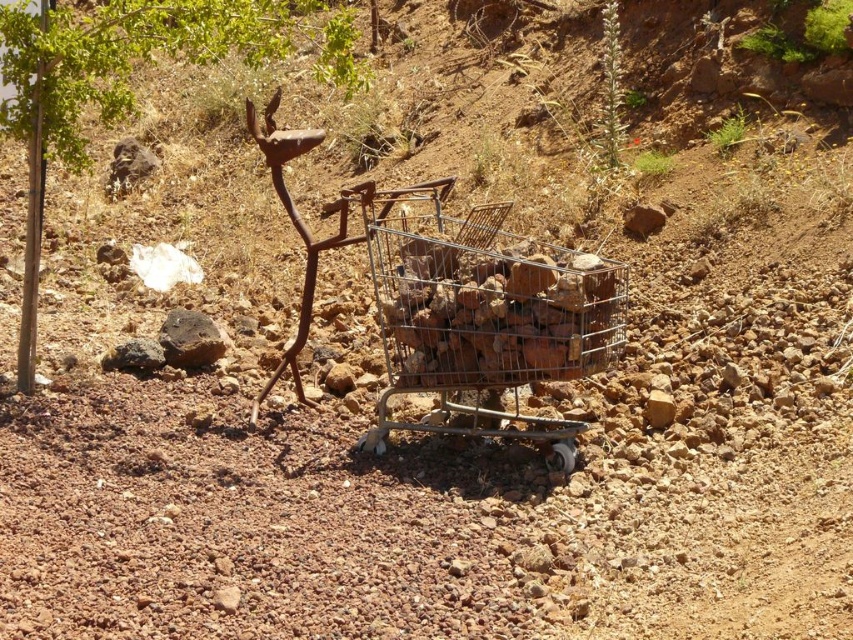
You are a hiker trying to carry your gear. You have a metallic wire crate at center and a green leafy tree at upper left. Which one is narrower in width?

The metallic wire crate at center is narrower in width than the green leafy tree at upper left.

You are a hiker trying to navigate through this rocky desert area. You need to pass by both the rusty metal shopping cart at center and the green leafy tree at upper left. Which object will you have to look up more to see?

The rusty metal shopping cart at center is taller than the green leafy tree at upper left, so you will have to look up more to see the rusty metal shopping cart at center.

You are standing at the origin point of the image. Where is the rusty metal shopping cart at center located in relation to you?

The rusty metal shopping cart at center is located at point (461, 305) relative to the origin point.